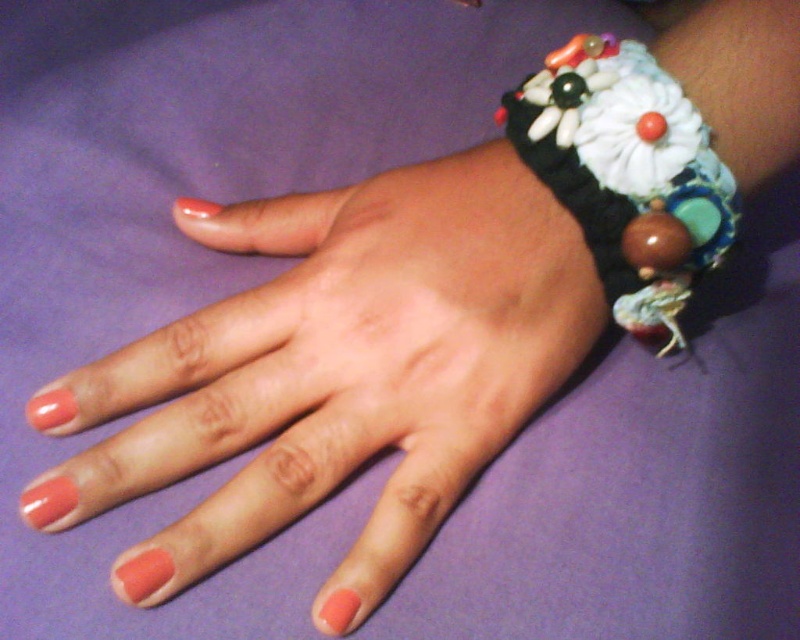
Question: Can you confirm if matte black bracelet at upper right is smaller than textured fabric bracelet at upper right?

Choices:
 (A) no
 (B) yes

Answer: (A)

Question: Does matte black bracelet at upper right appear on the left side of textured fabric bracelet at upper right?

Choices:
 (A) yes
 (B) no

Answer: (A)

Question: From the image, what is the correct spatial relationship of matte black bracelet at upper right in relation to textured fabric bracelet at upper right?

Choices:
 (A) below
 (B) above

Answer: (A)

Question: Which of the following is the closest to the observer?

Choices:
 (A) textured fabric bracelet at upper right
 (B) matte black bracelet at upper right

Answer: (B)